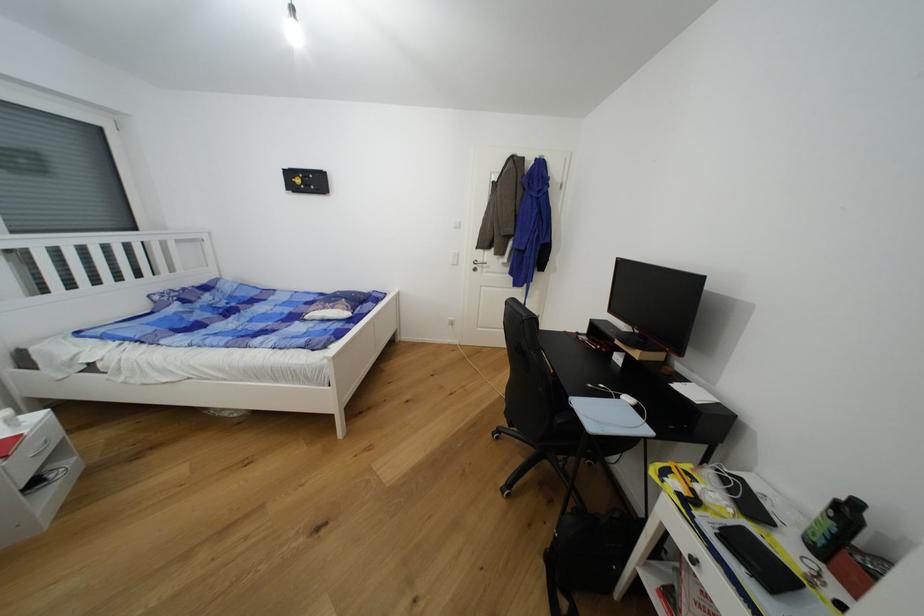
Locate an element on the screen. Image resolution: width=924 pixels, height=616 pixels. white computer mouse is located at coordinates (628, 399).